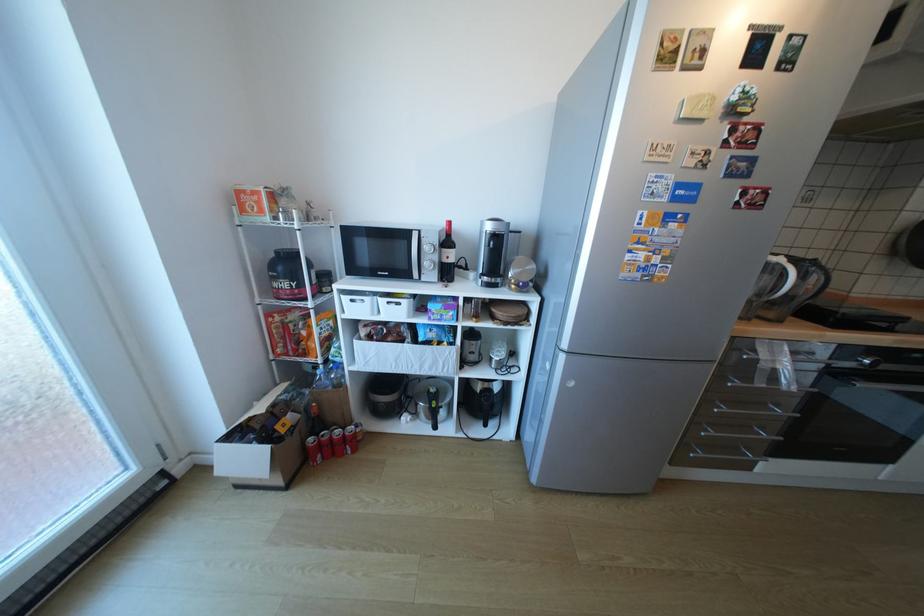
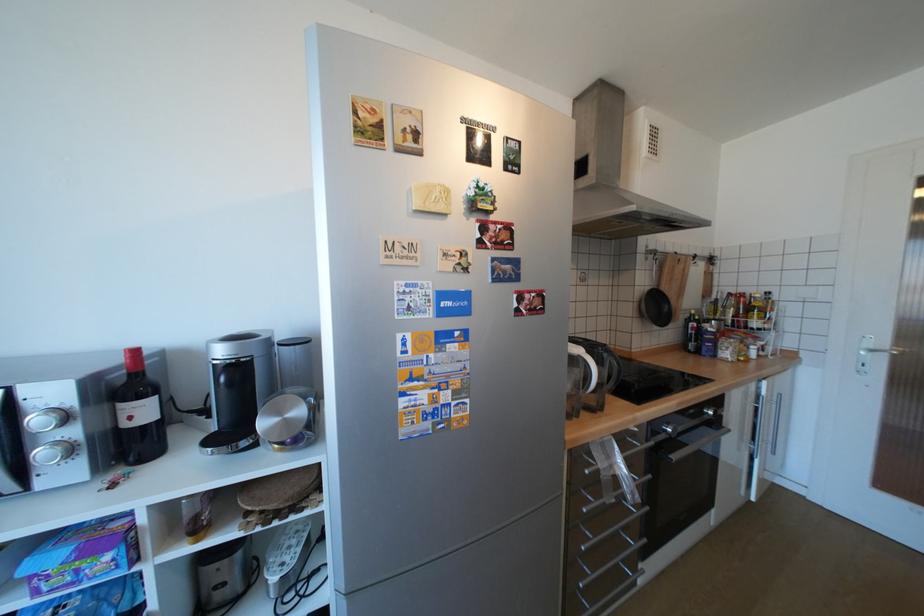
In the second image, find the point that corresponds to [434,264] in the first image.

(52, 453)